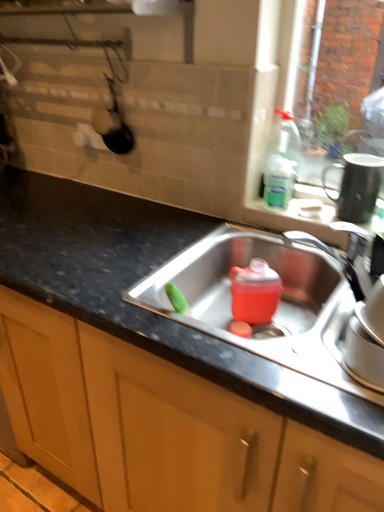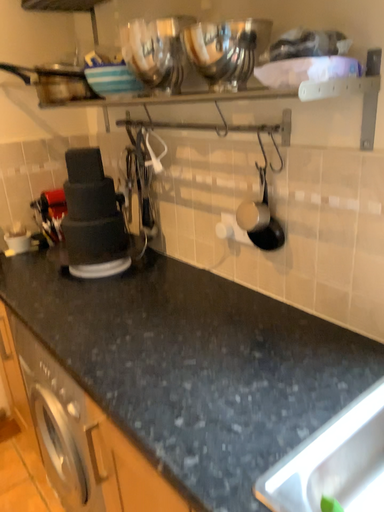
Question: How did the camera likely rotate when shooting the video?

Choices:
 (A) rotated downward
 (B) rotated upward

Answer: (B)